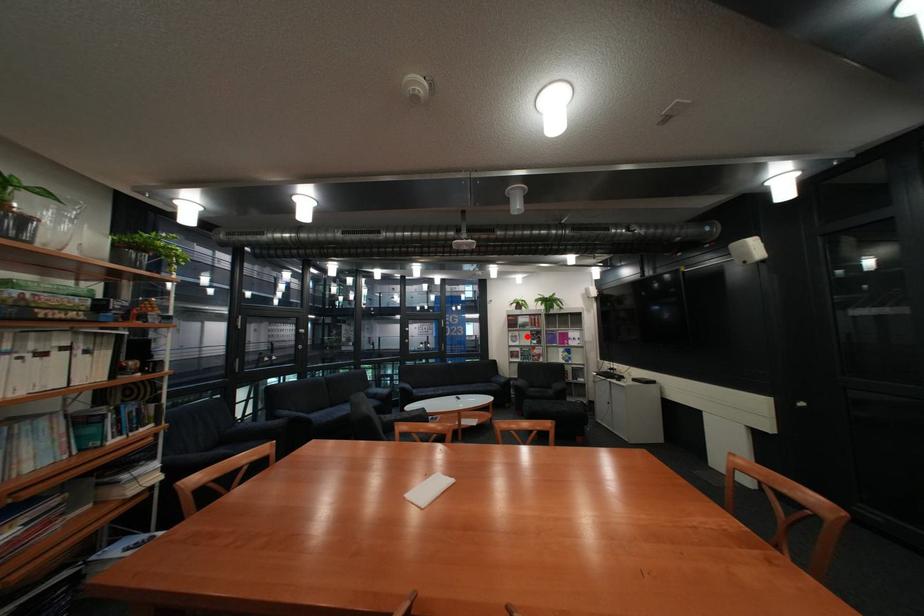
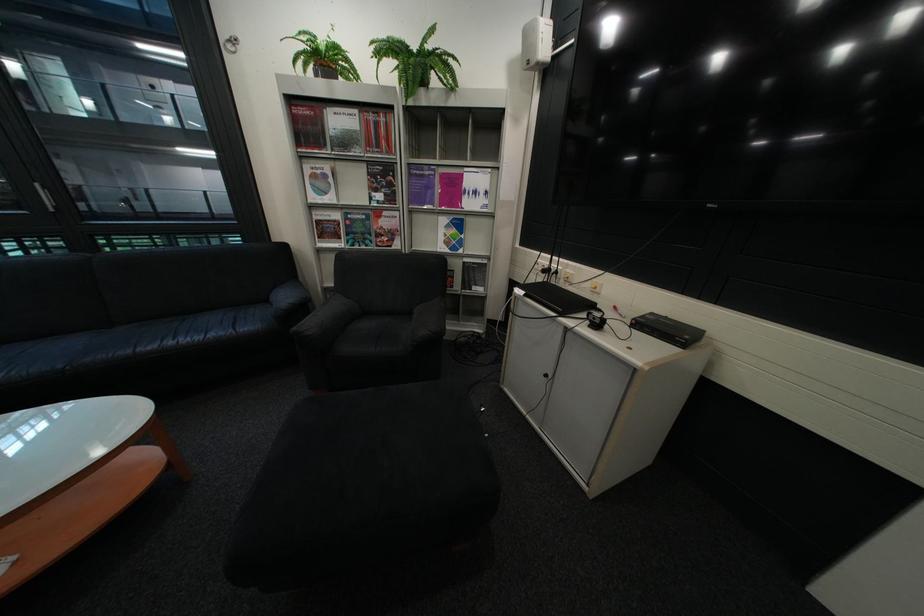
Question: I am providing you with two images of the same scene from different viewpoints. In image1, a red point is highlighted. Considering the same 3D point in image2, which of the following is correct?

Choices:
 (A) It is closer
 (B) It is farther

Answer: (A)